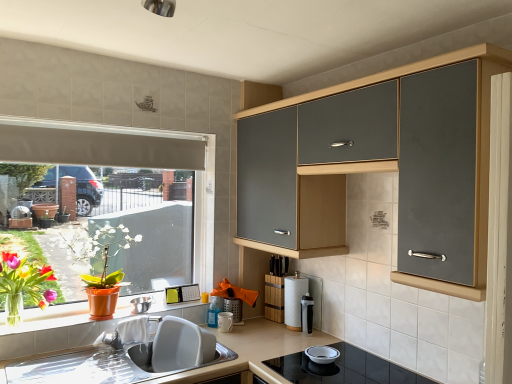
Image resolution: width=512 pixels, height=384 pixels. I want to click on free location to the left of black plastic water bottle at upper right, which is the 6th appliance in left-to-right order, so click(x=275, y=337).